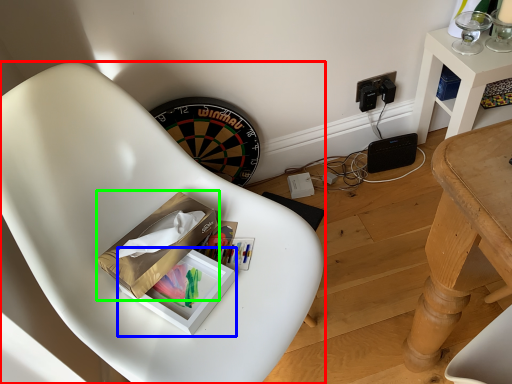
Question: Based on their relative distances, which object is farther from chair (highlighted by a red box)? Choose from box (highlighted by a blue box) and cardboard box (highlighted by a green box).

Choices:
 (A) box
 (B) cardboard box

Answer: (A)